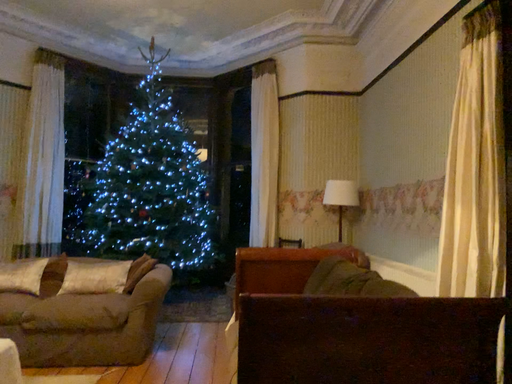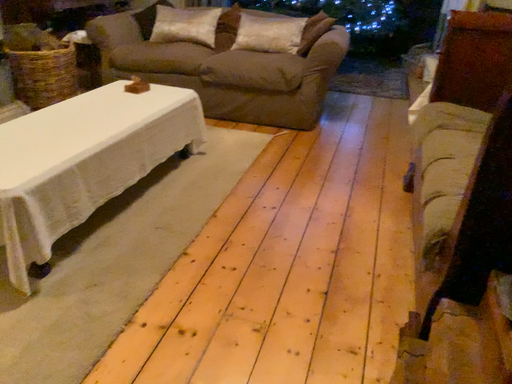
Question: Which way did the camera rotate in the video?

Choices:
 (A) rotated upward
 (B) rotated downward

Answer: (B)